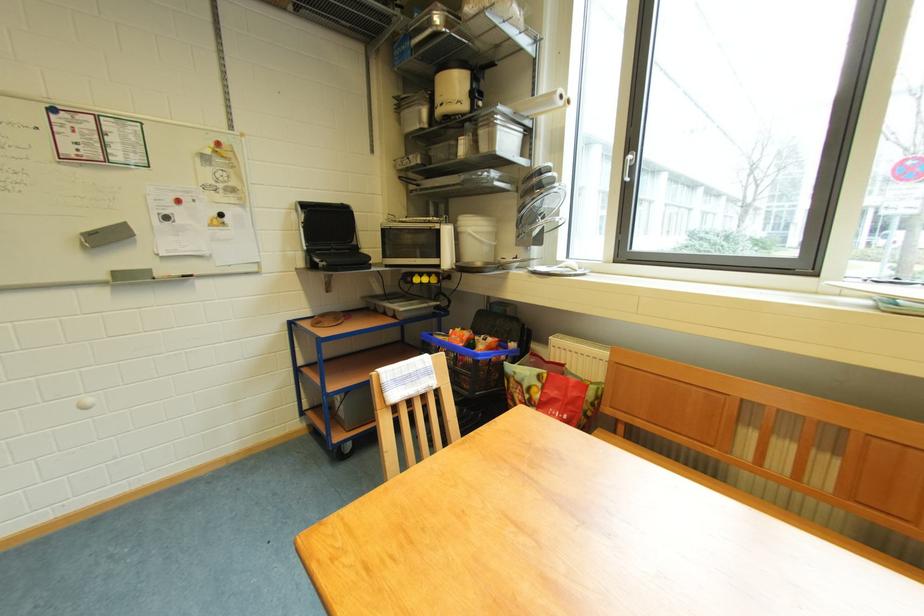
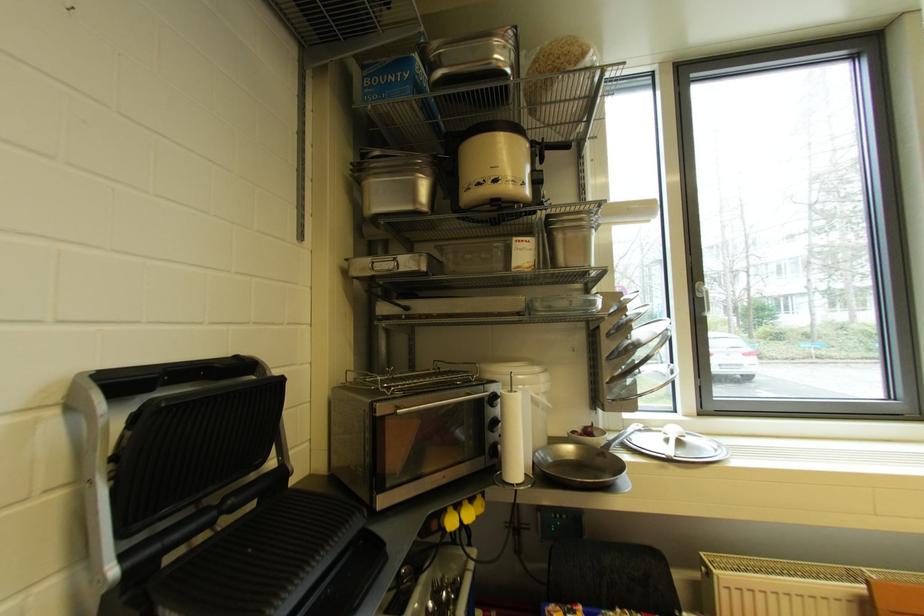
Find the pixel in the second image that matches pixel 587 270 in the first image.

(695, 437)